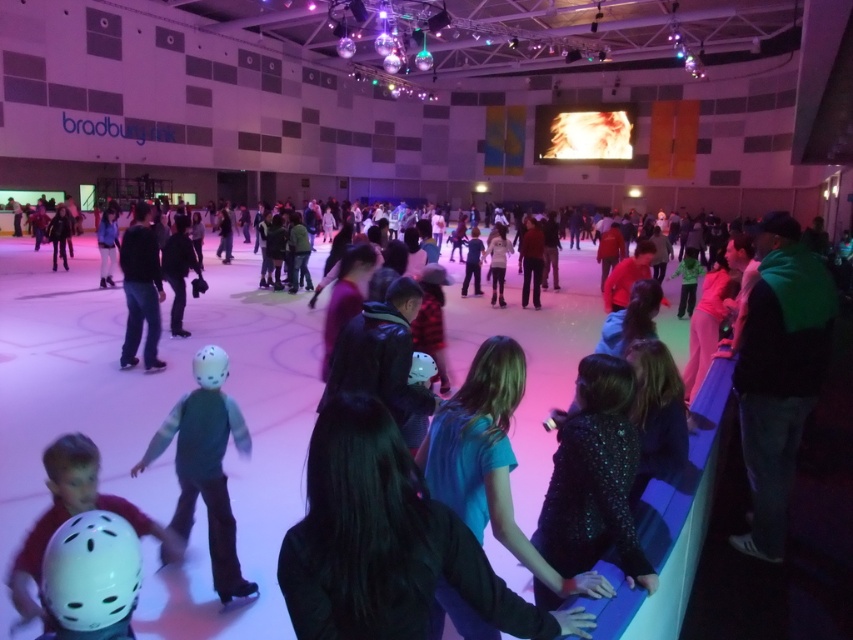
You are a photographer positioned at the back of the ice rink and want to take a photo of both the green fuzzy vest at center and the white matte helmet at lower left. Which object will appear larger in your photo?

The green fuzzy vest at center will appear larger in the photo because it is closer to the photographer than the white matte helmet at lower left.